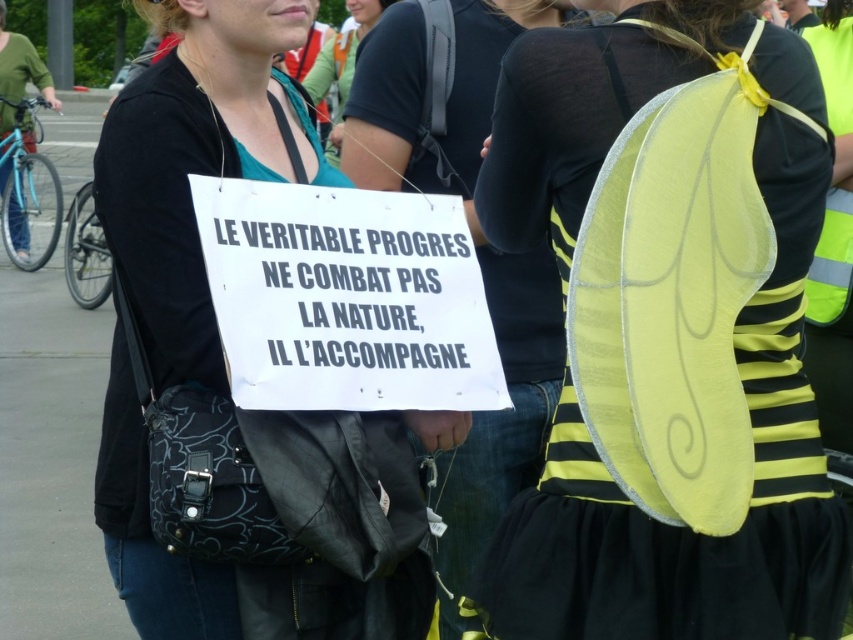
Question: Based on their relative distances, which object is nearer to the white paper sign at center?

Choices:
 (A) yellow fabric wings at center
 (B) yellow fabric wings at upper right
 (C) matte black shirt at upper center

Answer: (A)

Question: Which of the following is the farthest from the observer?

Choices:
 (A) (520, 8)
 (B) (389, 1)

Answer: (B)

Question: Which of the following is the closest to the observer?

Choices:
 (A) matte black shirt at upper center
 (B) yellow fabric wings at center

Answer: (B)

Question: Can you confirm if yellow fabric wings at center is thinner than matte black shirt at upper center?

Choices:
 (A) no
 (B) yes

Answer: (B)

Question: Considering the relative positions of yellow fabric wings at upper right and matte black shirt at upper center in the image provided, where is yellow fabric wings at upper right located with respect to matte black shirt at upper center?

Choices:
 (A) right
 (B) left

Answer: (A)

Question: Can you confirm if white paper sign at center is positioned to the right of matte black shirt at upper center?

Choices:
 (A) yes
 (B) no

Answer: (A)